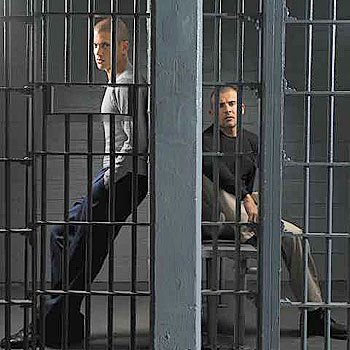
Identify the location of bars. The width and height of the screenshot is (350, 350). (50, 155).